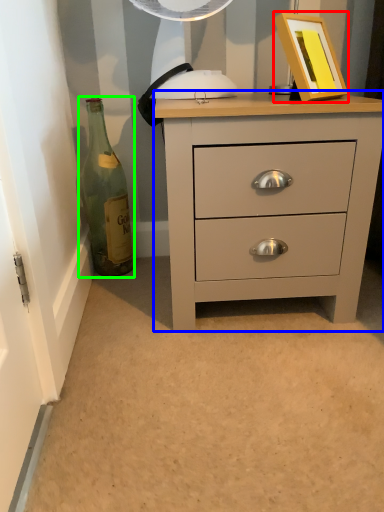
Question: Which object is the farthest from picture frame (highlighted by a red box)? Choose among these: chest of drawers (highlighted by a blue box) or bottle (highlighted by a green box).

Choices:
 (A) chest of drawers
 (B) bottle

Answer: (B)